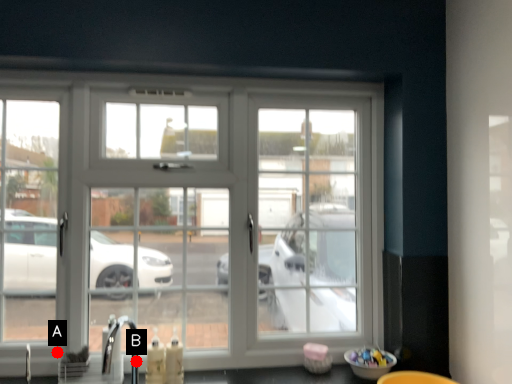
Question: Two points are circled on the image, labeled by A and B beside each circle. Which of the following is the farthest from the observer?

Choices:
 (A) A is further
 (B) B is further

Answer: (A)